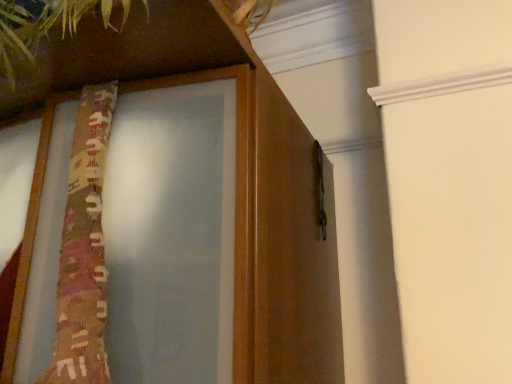
Where is `wooden frame at left`? The image size is (512, 384). wooden frame at left is located at coordinates (236, 201).

The height and width of the screenshot is (384, 512). What do you see at coordinates (236, 201) in the screenshot? I see `wooden frame at left` at bounding box center [236, 201].

At what (x,y) coordinates should I click in order to perform the action: click on wooden frame at left. Please return your answer as a coordinate pair (x, y). This screenshot has width=512, height=384. Looking at the image, I should click on (236, 201).